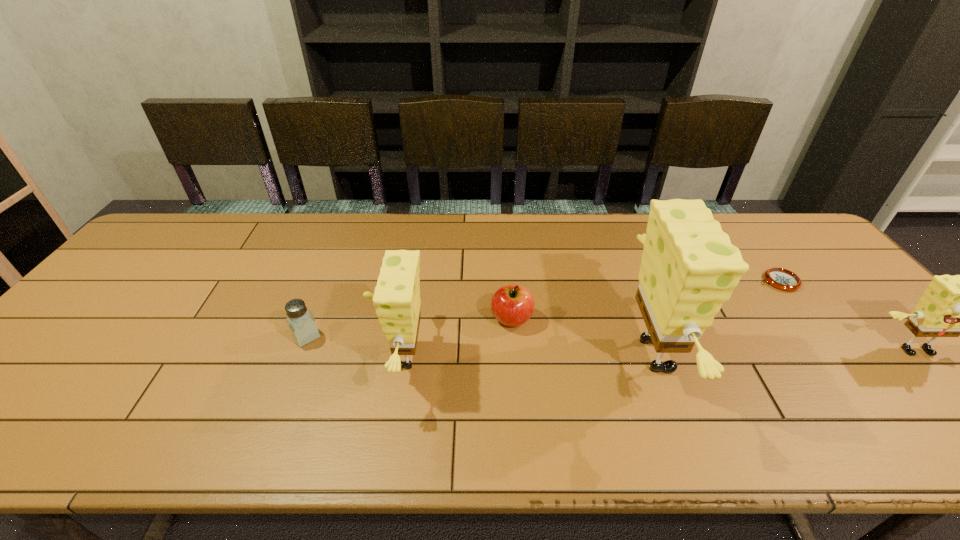
Please point a spot to add another sponge on the left. Please provide its 2D coordinates. Your answer should be formatted as a tuple, i.e. [(x, y)], where the tuple contains the x and y coordinates of a point satisfying the conditions above.

[(140, 358)]